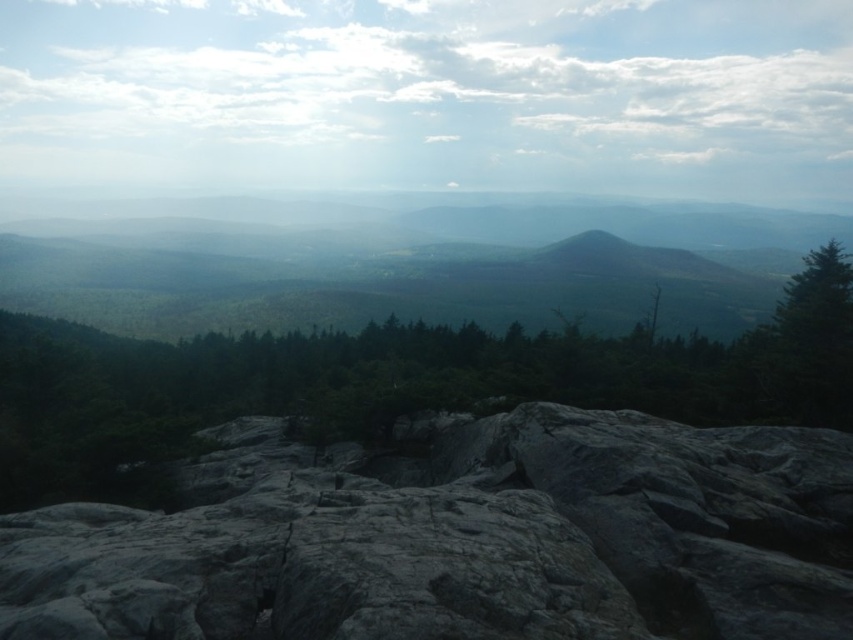
Is point (380, 508) closer to viewer compared to point (825, 412)?

Yes, point (380, 508) is closer to viewer.

Does point (338, 564) come farther from viewer compared to point (323, 413)?

No, it is in front of (323, 413).

Who is more distant from viewer, [735,464] or [167,372]?

The point [167,372] is behind.

Where is `gray rough rock at center`? This screenshot has height=640, width=853. gray rough rock at center is located at coordinates (459, 538).